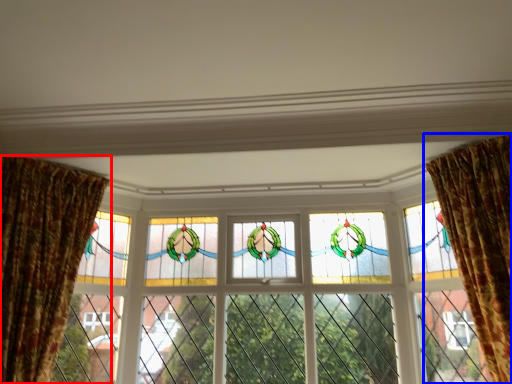
Question: Which object appears closest to the camera in this image, curtain (highlighted by a red box) or curtain (highlighted by a blue box)?

Choices:
 (A) curtain
 (B) curtain

Answer: (B)